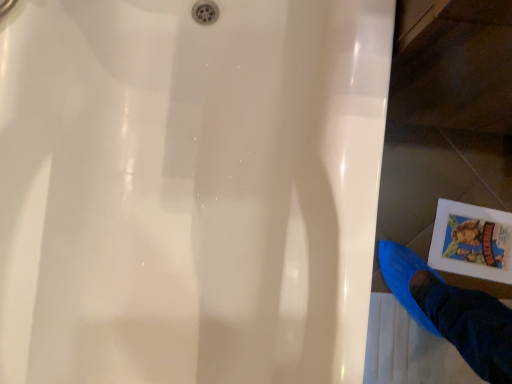
Image resolution: width=512 pixels, height=384 pixels. In order to click on free location to the left of white paper comic book at lower right in this screenshot , I will do (x=406, y=202).